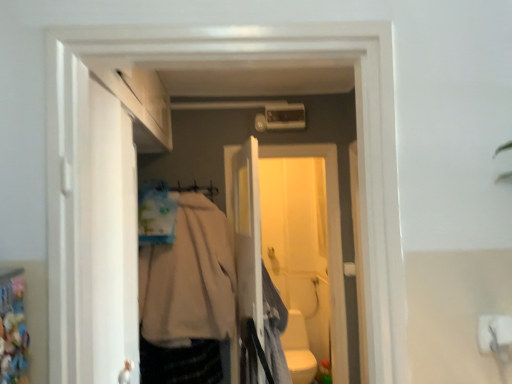
Locate an element on the screen. vacant region above white plastic screen door at center, the first screen door viewed from the back (from a real-world perspective) is located at coordinates (286, 139).